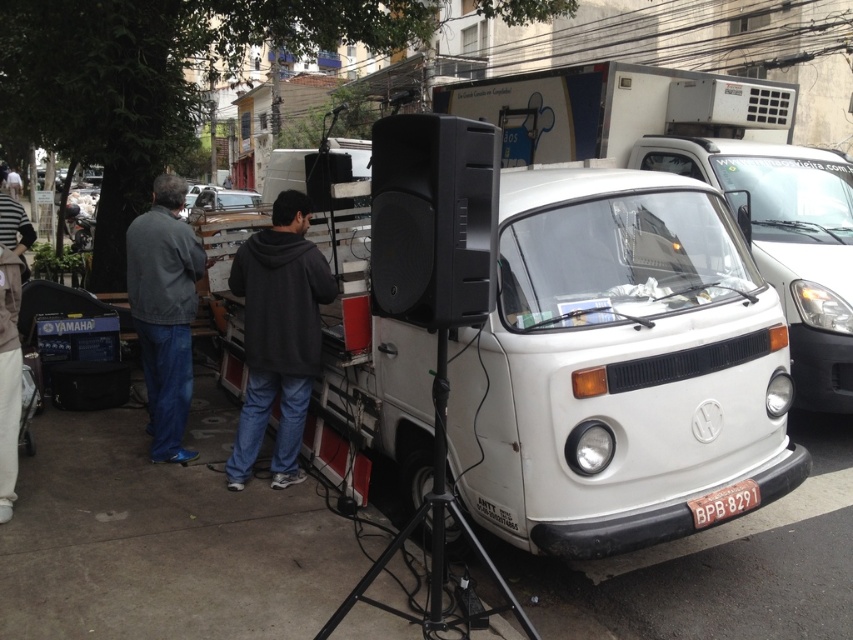
Question: Is white matte van at center to the right of metallic silver car at center from the viewer's perspective?

Choices:
 (A) no
 (B) yes

Answer: (B)

Question: Based on their relative distances, which object is farther from the black plastic license plate at lower center?

Choices:
 (A) white matte van at center
 (B) dark gray hoodie at center
 (C) metallic silver car at center
 (D) black metal tripod at center

Answer: (C)

Question: Can you confirm if white matte van at center is wider than black metal tripod at center?

Choices:
 (A) yes
 (B) no

Answer: (B)

Question: Among these points, which one is farthest from the camera?

Choices:
 (A) (213, 211)
 (B) (438, 362)
 (C) (305, 346)
 (D) (712, 499)

Answer: (A)

Question: Based on their relative distances, which object is nearer to the black metal tripod at center?

Choices:
 (A) metallic silver car at center
 (B) white matte van at center

Answer: (B)

Question: Does white matte van at center appear on the left side of dark gray jacket at left?

Choices:
 (A) no
 (B) yes

Answer: (A)